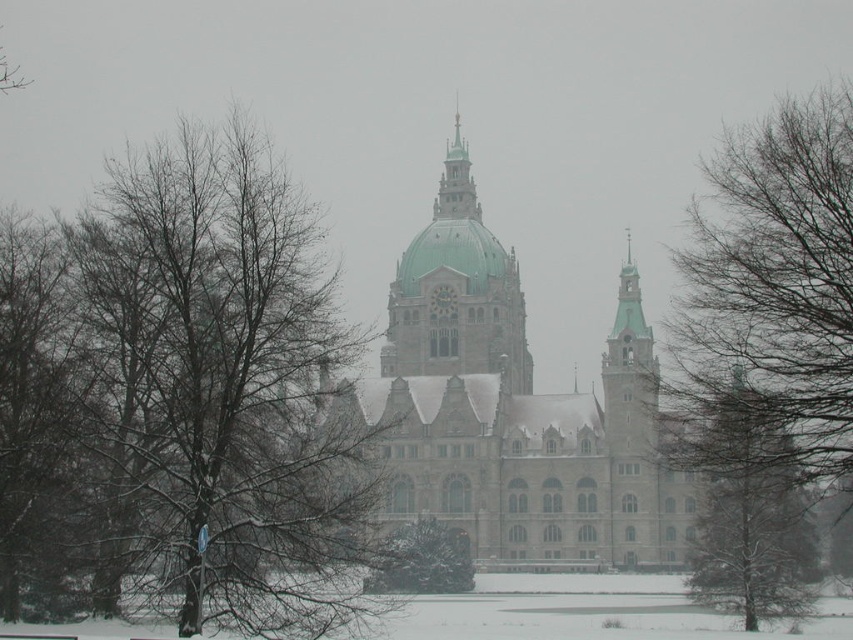
You are an architect evaluating the proportions of the historic building. Which object, the green glazed dome at center or the green textured tree at center, has a greater height?

The green glazed dome at center has a greater height compared to the green textured tree at center.

You are standing in front of the grand historic building and notice both the green textured tree at center and the polished copper spire at center. Which object is nearer to you?

The green textured tree at center is closer to the viewer than the polished copper spire at center, so the green textured tree at center is nearer to you.

You are standing in front of the historic building and want to take a photo of the green textured tree at center without the bare branches at left blocking it. How should you adjust your position?

Move to the right side of the green textured tree at center so that the bare branches at left are no longer in front of it.